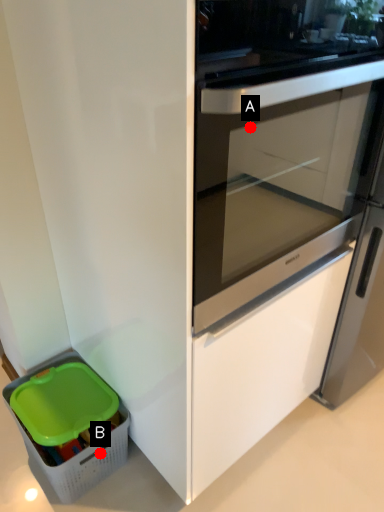
Question: Two points are circled on the image, labeled by A and B beside each circle. Among these points, which one is farthest from the camera?

Choices:
 (A) A is further
 (B) B is further

Answer: (A)